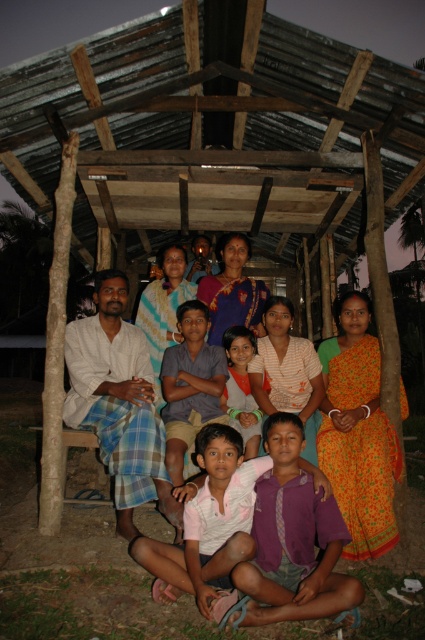
Question: Which point appears farthest from the camera in this image?

Choices:
 (A) (266, 596)
 (B) (209, 464)
 (C) (119, 452)
 (D) (354, 458)

Answer: (D)

Question: Can you confirm if white cotton kurta at left is positioned to the left of pink fabric shirt at lower center?

Choices:
 (A) no
 (B) yes

Answer: (B)

Question: Considering the relative positions of pink fabric shirt at lower center and orange cotton shirt at center in the image provided, where is pink fabric shirt at lower center located with respect to orange cotton shirt at center?

Choices:
 (A) below
 (B) above

Answer: (A)

Question: Among these points, which one is farthest from the camera?

Choices:
 (A) (105, 387)
 (B) (241, 435)

Answer: (B)

Question: Can you confirm if white cotton kurta at left is bigger than orange cotton shirt at center?

Choices:
 (A) no
 (B) yes

Answer: (B)

Question: Which of the following is the farthest from the observer?

Choices:
 (A) pink fabric shirt at lower center
 (B) orange cotton shirt at center
 (C) purple cotton shirt at center
 (D) multicolored fabric dress at center

Answer: (B)